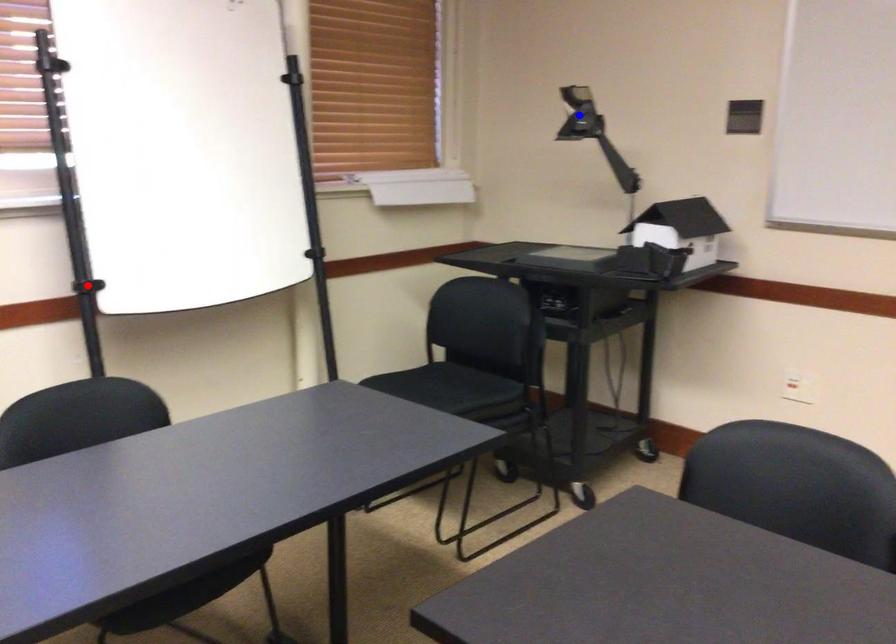
Question: Which of the two points in the image is closer to the camera?

Choices:
 (A) Blue point is closer.
 (B) Red point is closer.

Answer: (B)